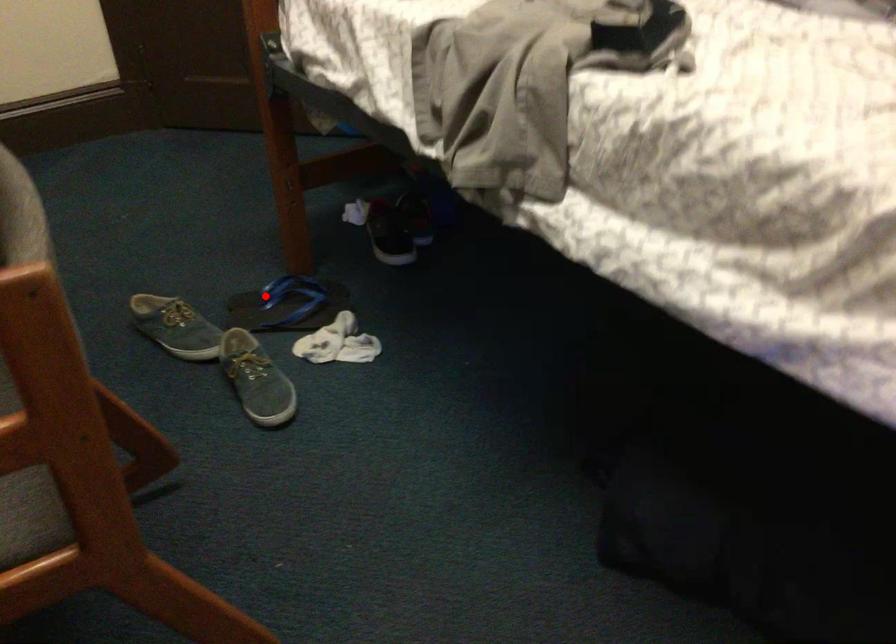
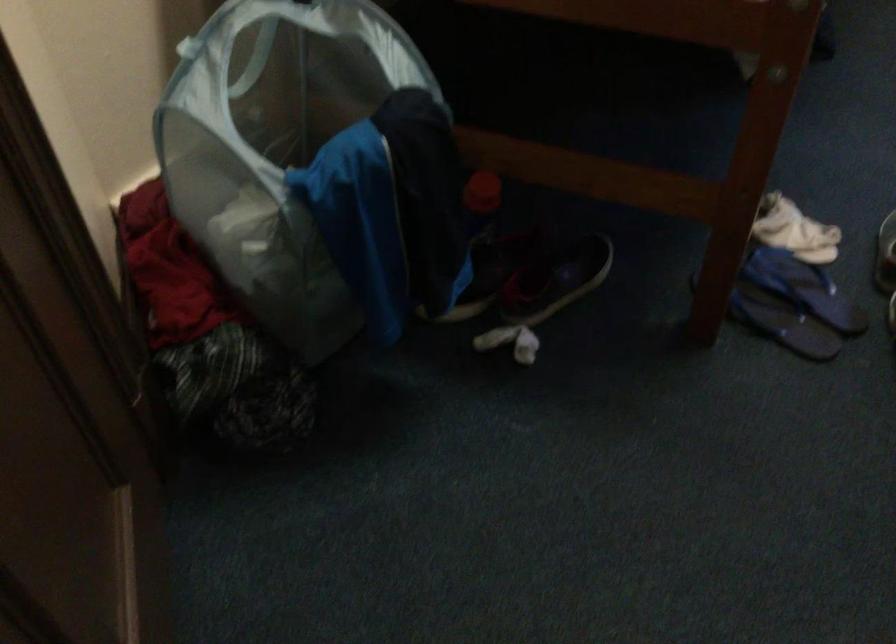
Question: I am providing you with two images of the same scene from different viewpoints. In image1, a red point is highlighted. Considering the same 3D point in image2, which of the following is correct?

Choices:
 (A) It is closer
 (B) It is farther

Answer: (A)